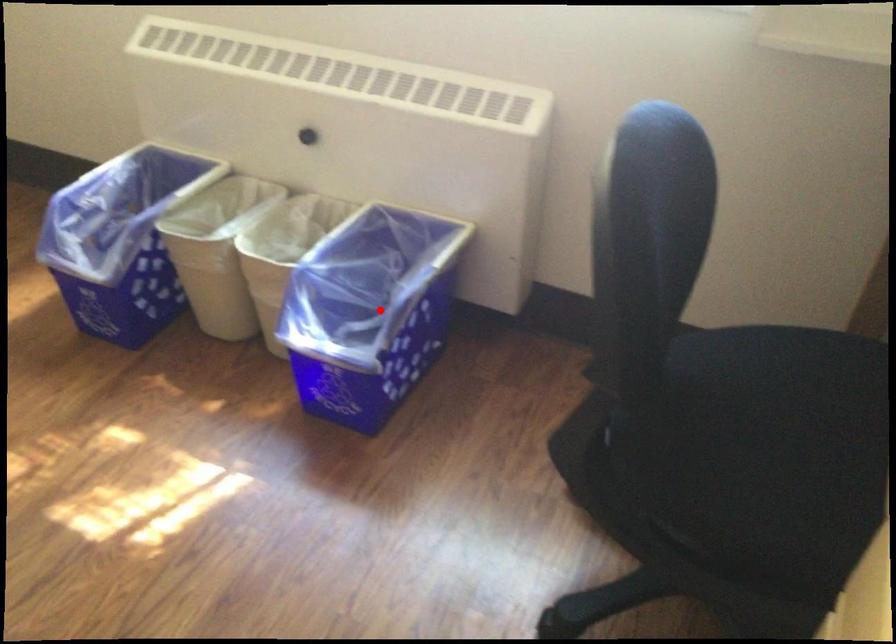
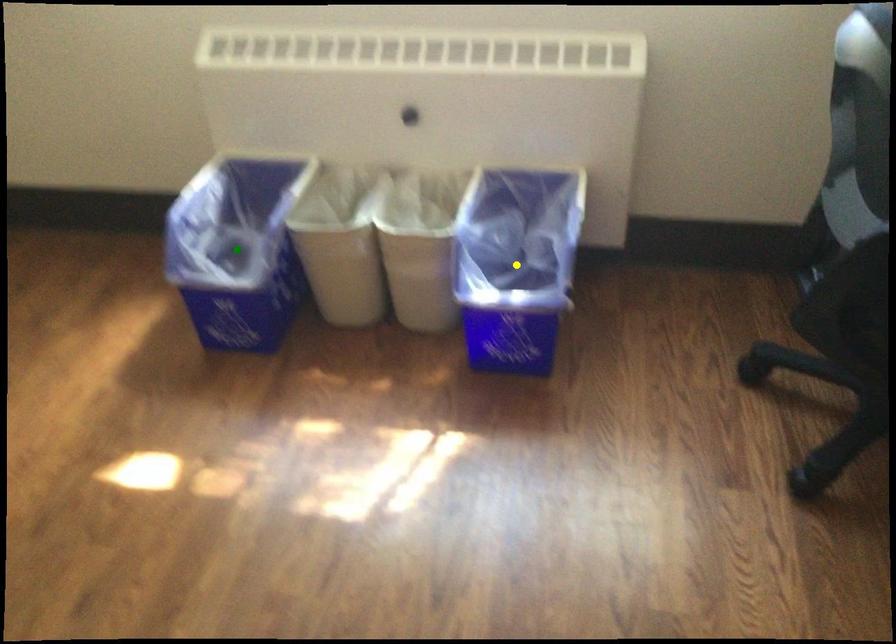
Question: I am providing you with two images of the same scene from different viewpoints. A red point is marked on the first image. You are given multiple points on the second image. Which point in image 2 is actually the same real-world point as the red point in image 1?

Choices:
 (A) blue point
 (B) green point
 (C) yellow point

Answer: (C)